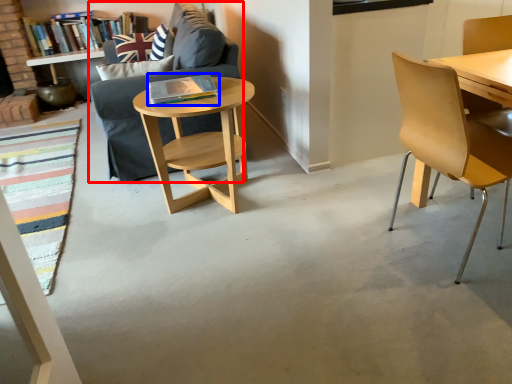
Question: Which object is closer to the camera taking this photo, studio couch (highlighted by a red box) or book (highlighted by a blue box)?

Choices:
 (A) studio couch
 (B) book

Answer: (B)